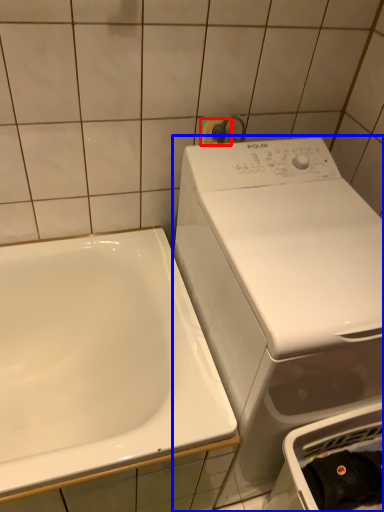
Question: Which point is further to the camera, towel bar (highlighted by a red box) or washing machine (highlighted by a blue box)?

Choices:
 (A) towel bar
 (B) washing machine

Answer: (A)